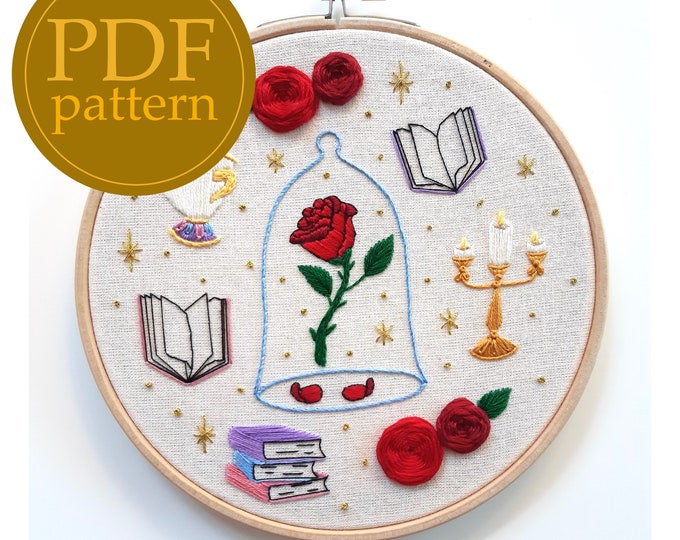
Where is `gold candelabra`? Image resolution: width=680 pixels, height=540 pixels. gold candelabra is located at coordinates (496, 316).